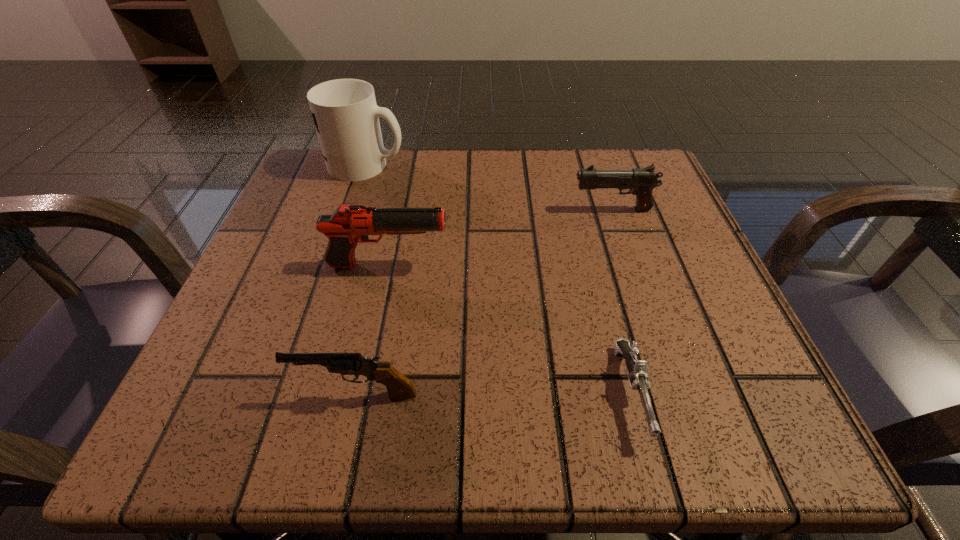
Where is `object that stands as the fourth closest to the tallest object`? object that stands as the fourth closest to the tallest object is located at coordinates (637, 369).

Find the location of a particular element. the second closest gun relative to the farthest gun is located at coordinates coord(637,369).

Image resolution: width=960 pixels, height=540 pixels. In order to click on gun that is the second nearest to the second farthest object in this screenshot , I will do `click(637, 369)`.